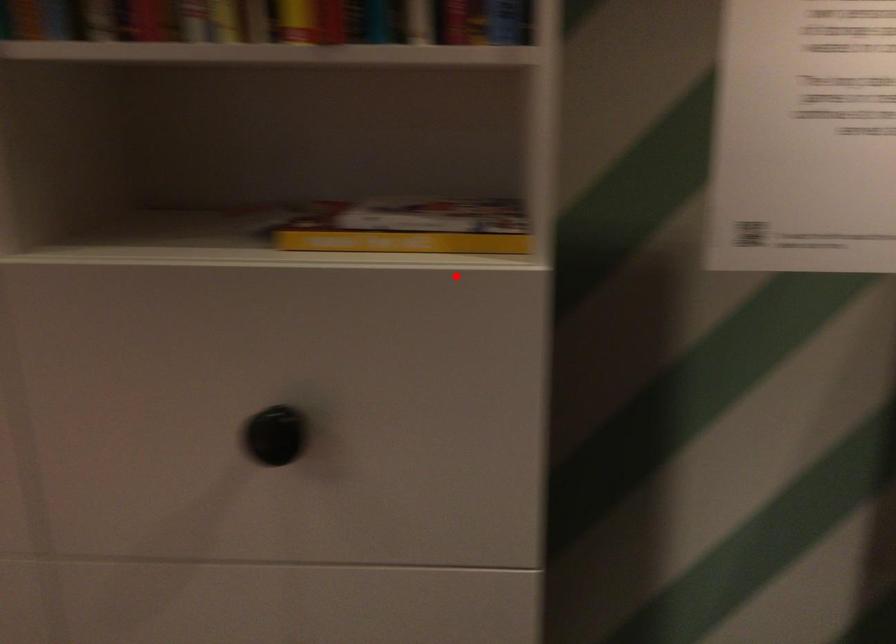
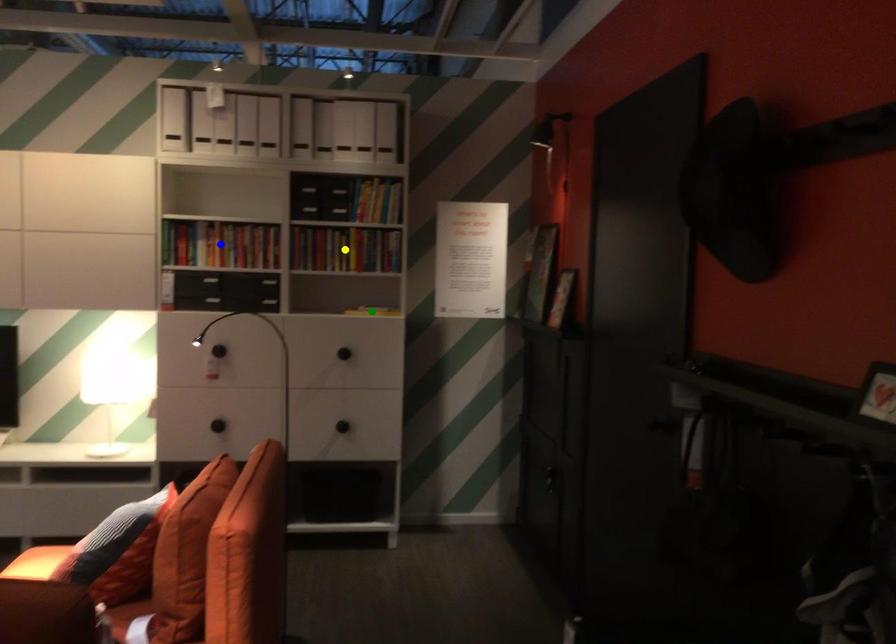
Question: I am providing you with two images of the same scene from different viewpoints. A red point is marked on the first image. You are given multiple points on the second image. Which mark in image 2 goes with the point in image 1?

Choices:
 (A) blue point
 (B) green point
 (C) yellow point

Answer: (B)